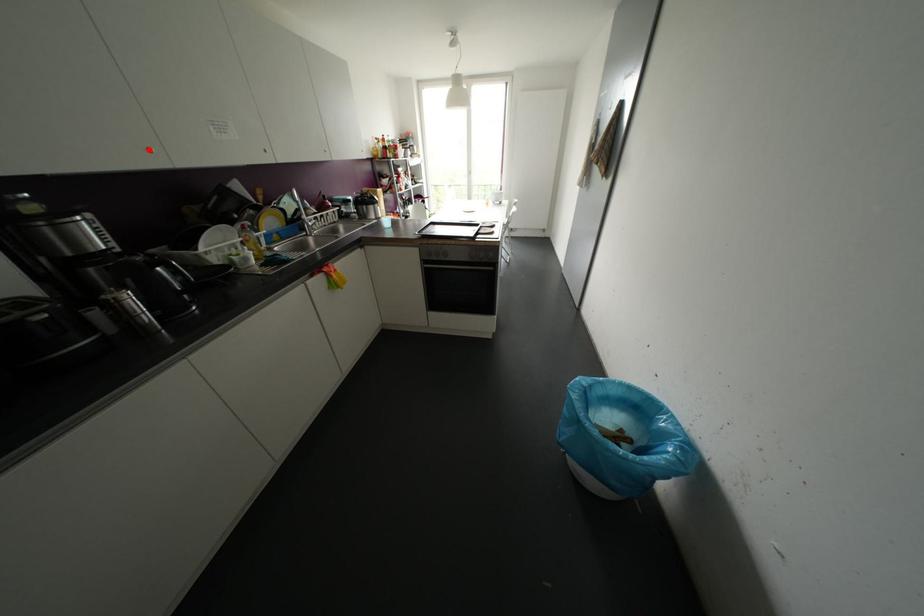
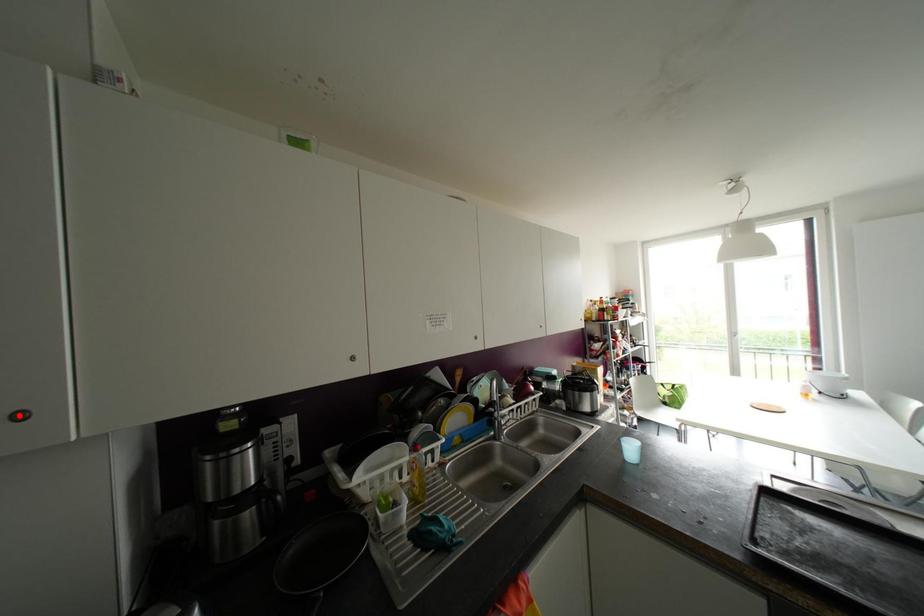
I am providing you with two images of the same scene from different viewpoints. A red point is marked on the first image and another point is marked on the second image. Are the points marked in image1 and image2 representing the same 3D position?

No